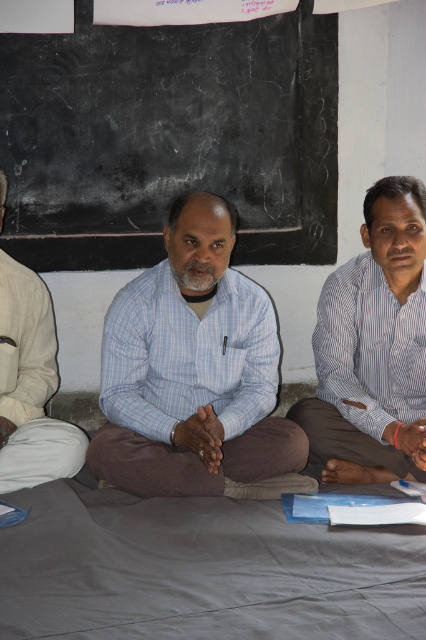
You are standing in front of the scene and want to touch both points mentioned. Which point should you reach for first, point (207, 140) or point (258, 374)?

You should reach for point (207, 140) first because it is closer to you than point (258, 374).

You are standing in the room where the three people are sitting against the wall with the blackboard. There are two points marked in the scene. Which point is closer to you, point (178,54) or point (389,291)?

Point (178,54) is closer to you than point (389,291) because it is further to the viewer according to the description.

Based on the coordinates provided, which person is located at point (193, 372)?

The point (193, 372) corresponds to the blue checkered shirt at center.